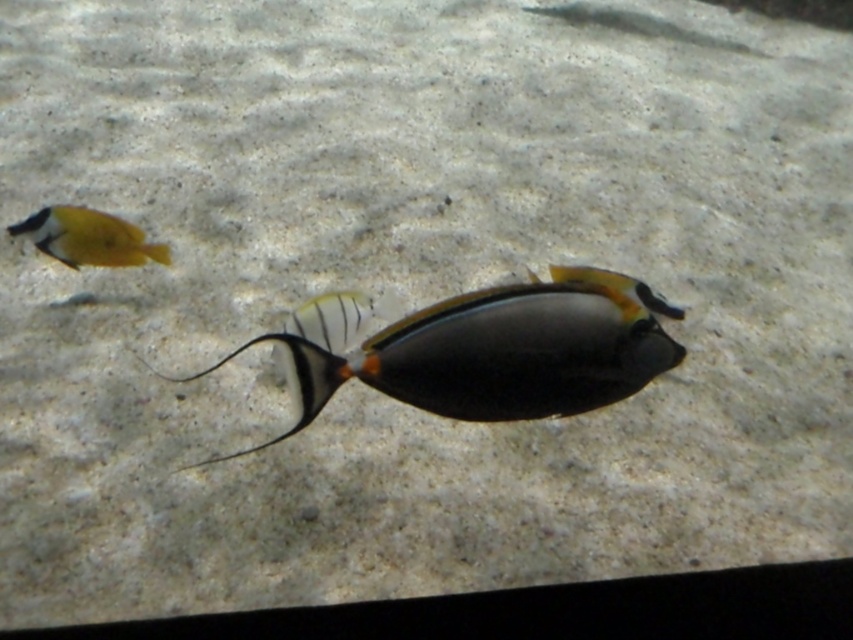
In the scene shown: Is shiny black fish at center above yellow matte fish at upper left?

Actually, shiny black fish at center is below yellow matte fish at upper left.

Between point (550, 316) and point (112, 234), which one is positioned behind?

The point (112, 234) is more distant.

This screenshot has width=853, height=640. In order to click on shiny black fish at center in this screenshot , I will do `click(495, 352)`.